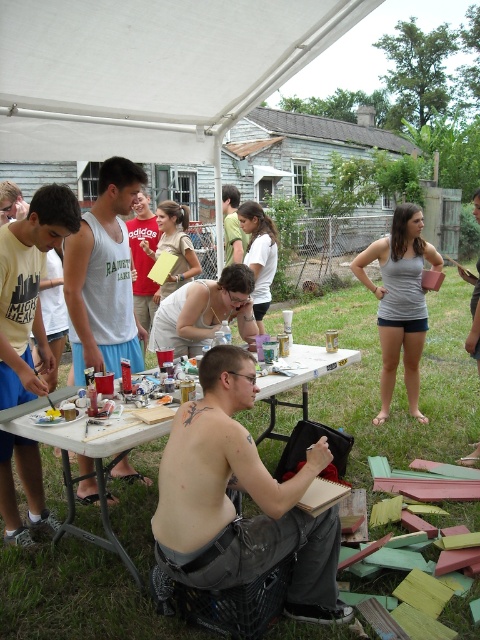
Question: Which point is closer to the camera?

Choices:
 (A) (288, 385)
 (B) (38, 241)
 (C) (235, 224)

Answer: (B)

Question: Estimate the real-world distances between objects in this image. Which object is closer to the smooth white tank top at center?

Choices:
 (A) matte white tank top at left
 (B) white plastic table at center
 (C) red cotton t-shirt at center
 (D) white tank top at center

Answer: (C)

Question: Where is white tank top at center located in relation to white plastic table at center in the image?

Choices:
 (A) below
 (B) above

Answer: (B)

Question: Does matte white tank top at left have a larger size compared to white plastic table at center?

Choices:
 (A) no
 (B) yes

Answer: (B)

Question: Which object appears farthest from the camera in this image?

Choices:
 (A) white plastic table at center
 (B) white tank top at center
 (C) smooth white tank top at center

Answer: (C)

Question: Does white tank top at center have a smaller size compared to red cotton t-shirt at center?

Choices:
 (A) no
 (B) yes

Answer: (B)